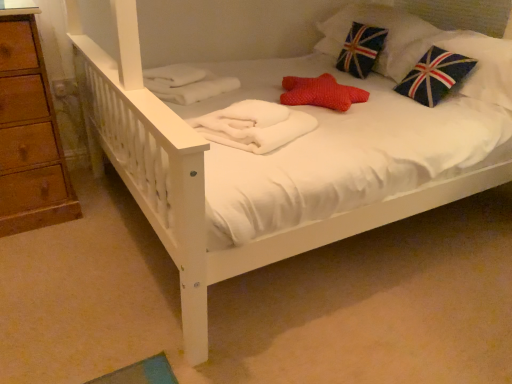
Question: Is white fluffy blanket at center bigger or smaller than velvet union jack pillow at upper right?

Choices:
 (A) big
 (B) small

Answer: (B)

Question: From a real-world perspective, relative to velvet union jack pillow at upper right, is white fluffy blanket at center vertically above or below?

Choices:
 (A) above
 (B) below

Answer: (B)

Question: Visually, is white fluffy blanket at center positioned to the left or to the right of velvet union jack pillow at upper right?

Choices:
 (A) right
 (B) left

Answer: (B)

Question: Considering the positions of velvet union jack pillow at upper right and white fluffy blanket at center in the image, is velvet union jack pillow at upper right taller or shorter than white fluffy blanket at center?

Choices:
 (A) short
 (B) tall

Answer: (B)

Question: Does point (387, 44) appear closer or farther from the camera than point (216, 140)?

Choices:
 (A) farther
 (B) closer

Answer: (A)

Question: Is velvet union jack pillow at upper right inside or outside of white fluffy blanket at center?

Choices:
 (A) outside
 (B) inside

Answer: (A)

Question: From the image's perspective, is velvet union jack pillow at upper right located above or below white fluffy blanket at center?

Choices:
 (A) above
 (B) below

Answer: (A)